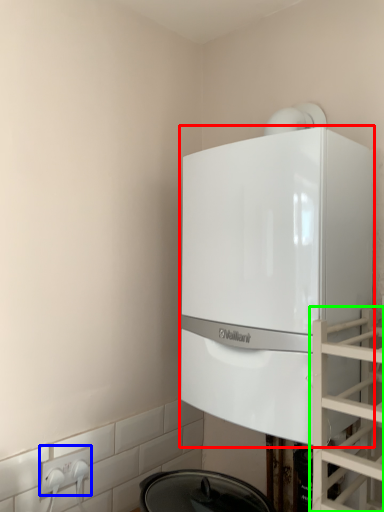
Question: Considering the real-world distances, which object is closest to home appliance (highlighted by a red box)? electric outlet (highlighted by a blue box) or glass door (highlighted by a green box).

Choices:
 (A) electric outlet
 (B) glass door

Answer: (B)